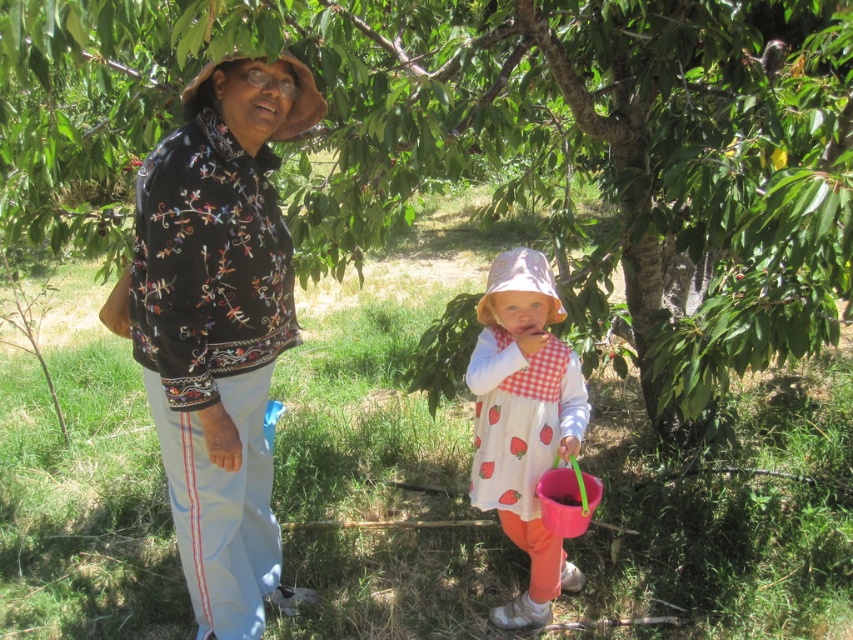
Locate an element on the screen. green leafy tree at center is located at coordinates (495, 147).

Does point (531, 109) lie in front of point (534, 468)?

No, it is not.

Where is `green leafy tree at center`? The width and height of the screenshot is (853, 640). green leafy tree at center is located at coordinates (495, 147).

In the scene shown: Is embroidered cotton jacket at center above white cotton dress with strawberry print at center?

Correct, embroidered cotton jacket at center is located above white cotton dress with strawberry print at center.

In the scene shown: Is embroidered cotton jacket at center to the right of white cotton dress with strawberry print at center from the viewer's perspective?

In fact, embroidered cotton jacket at center is to the left of white cotton dress with strawberry print at center.

What do you see at coordinates (219, 324) in the screenshot?
I see `embroidered cotton jacket at center` at bounding box center [219, 324].

This screenshot has height=640, width=853. I want to click on embroidered cotton jacket at center, so click(219, 324).

Who is positioned more to the right, green leafy tree at center or embroidered cotton jacket at center?

green leafy tree at center

Can you confirm if green leafy tree at center is smaller than embroidered cotton jacket at center?

No, green leafy tree at center is not smaller than embroidered cotton jacket at center.

Is point (90, 68) less distant than point (149, 316)?

No, it is behind (149, 316).

The height and width of the screenshot is (640, 853). Identify the location of green leafy tree at center. (495, 147).